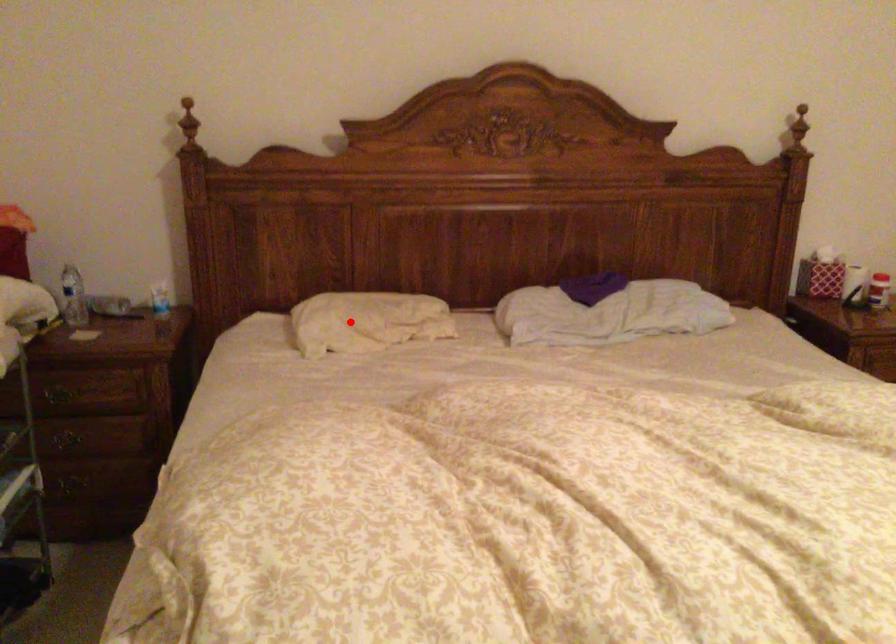
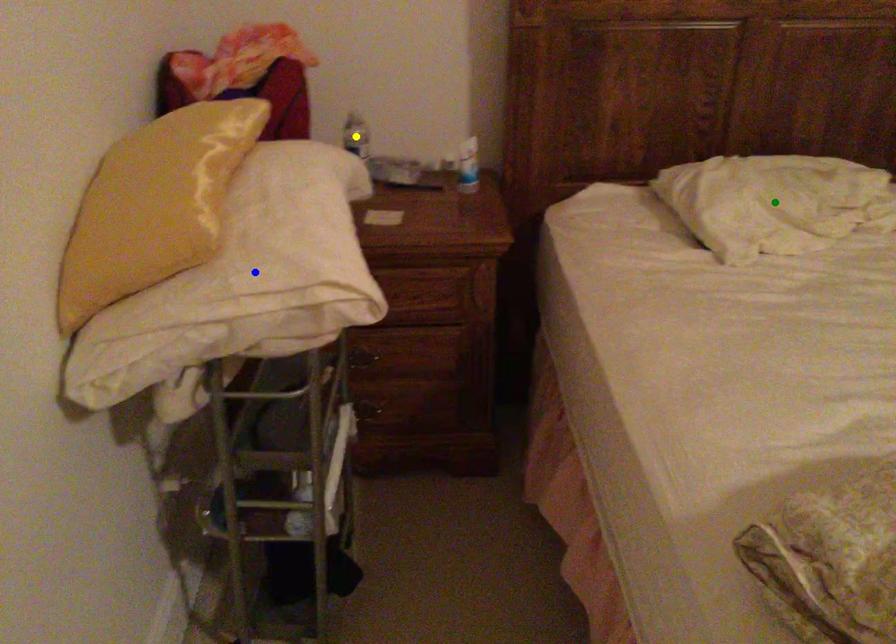
Question: I am providing you with two images of the same scene from different viewpoints. A red point is marked on the first image. You are given multiple points on the second image. Which point in image 2 is actually the same real-world point as the red point in image 1?

Choices:
 (A) yellow point
 (B) blue point
 (C) green point

Answer: (C)